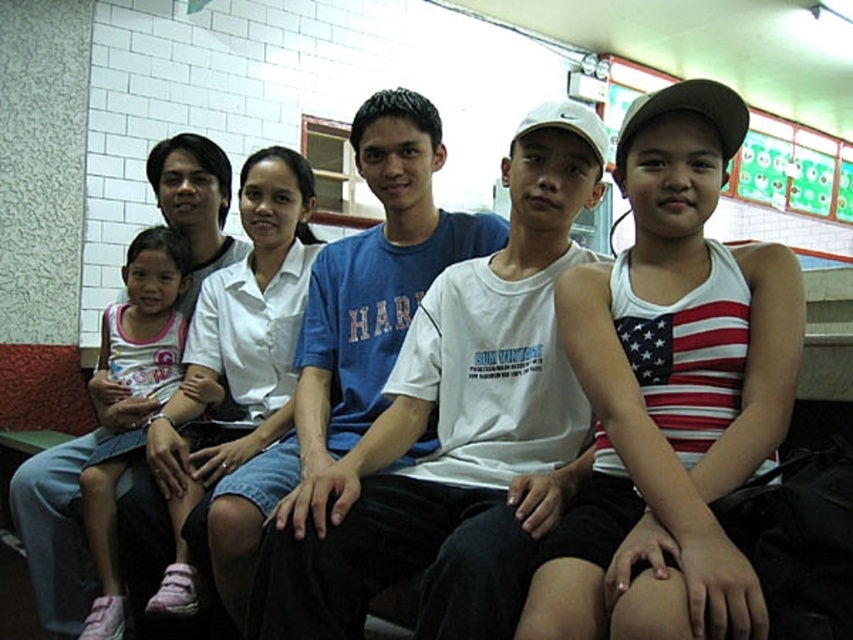
Does white cotton shirt at center appear on the left side of pink fabric dress at left?

No, white cotton shirt at center is not to the left of pink fabric dress at left.

Can you confirm if white cotton shirt at center is positioned to the right of pink fabric dress at left?

Correct, you'll find white cotton shirt at center to the right of pink fabric dress at left.

In the scene shown: Measure the distance between point (234, 452) and camera.

2.13 meters

Locate an element on the screen. The height and width of the screenshot is (640, 853). white cotton shirt at center is located at coordinates (245, 328).

Does white cotton tank top at center appear under pink fabric dress at left?

No.

Is white cotton tank top at center taller than pink fabric dress at left?

No.

Does point (602, 358) come closer to viewer compared to point (149, 344)?

Yes, point (602, 358) is in front of point (149, 344).

The width and height of the screenshot is (853, 640). What are the coordinates of `white cotton tank top at center` in the screenshot? It's located at (670, 392).

Find the location of a particular element. white cotton tank top at center is located at coordinates (670, 392).

Who is more distant from viewer, (775,246) or (258,204)?

The point (258,204) is behind.

Image resolution: width=853 pixels, height=640 pixels. Find the location of `white cotton tank top at center`. white cotton tank top at center is located at coordinates (670, 392).